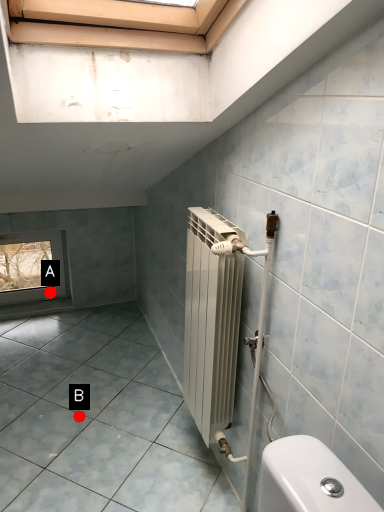
Question: Two points are circled on the image, labeled by A and B beside each circle. Which of the following is the farthest from the observer?

Choices:
 (A) A is further
 (B) B is further

Answer: (A)